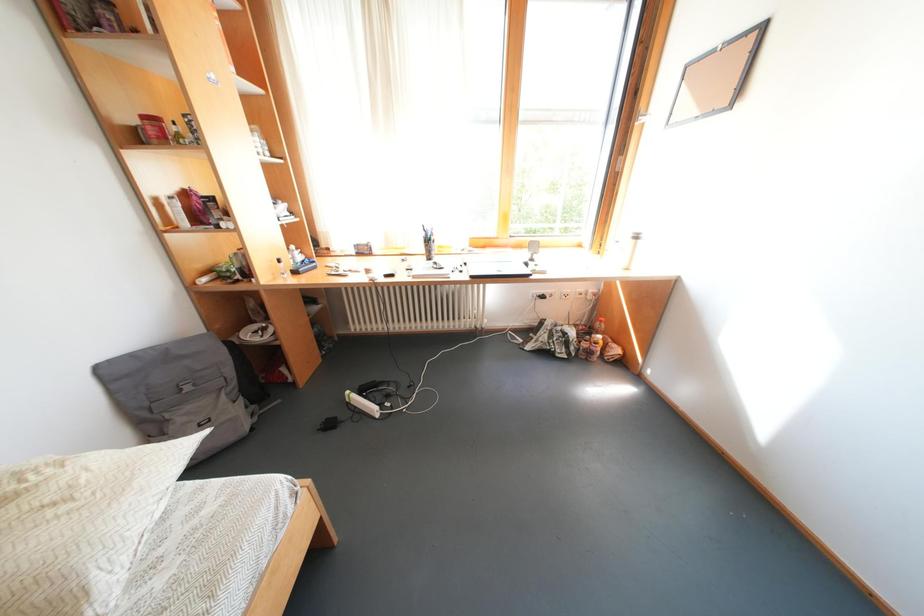
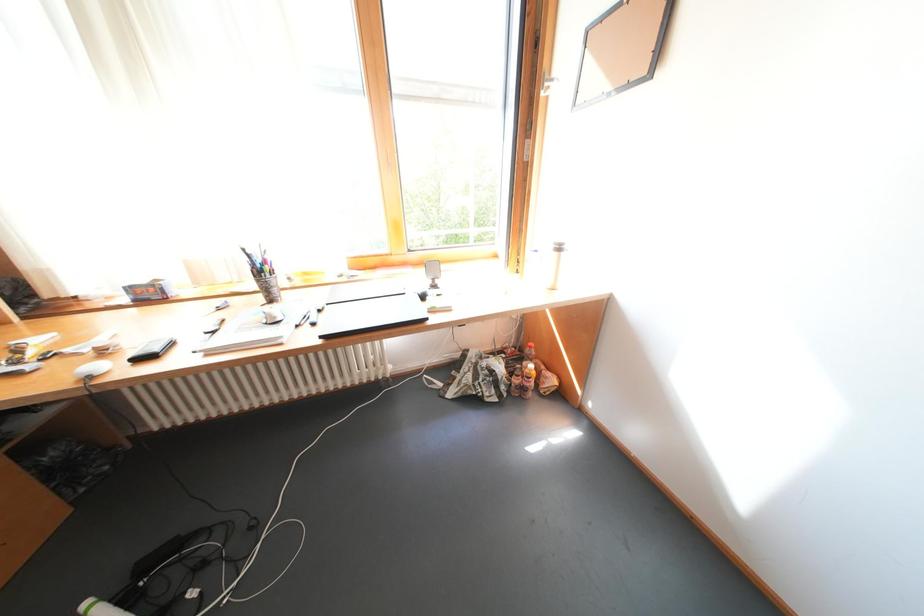
What movement of the cameraman would produce the second image?

The movement direction of the cameraman is right, forward.